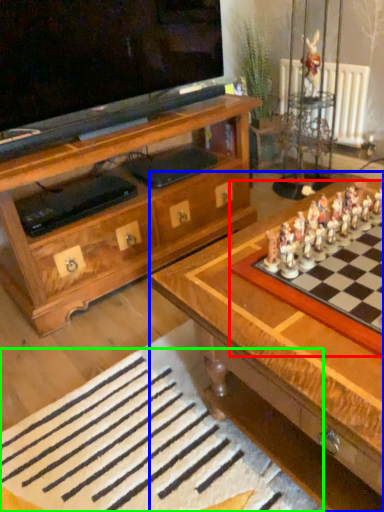
Question: Which object is positioned closest to board game (highlighted by a red box)? Select from table (highlighted by a blue box) and board (highlighted by a green box).

Choices:
 (A) table
 (B) board

Answer: (A)